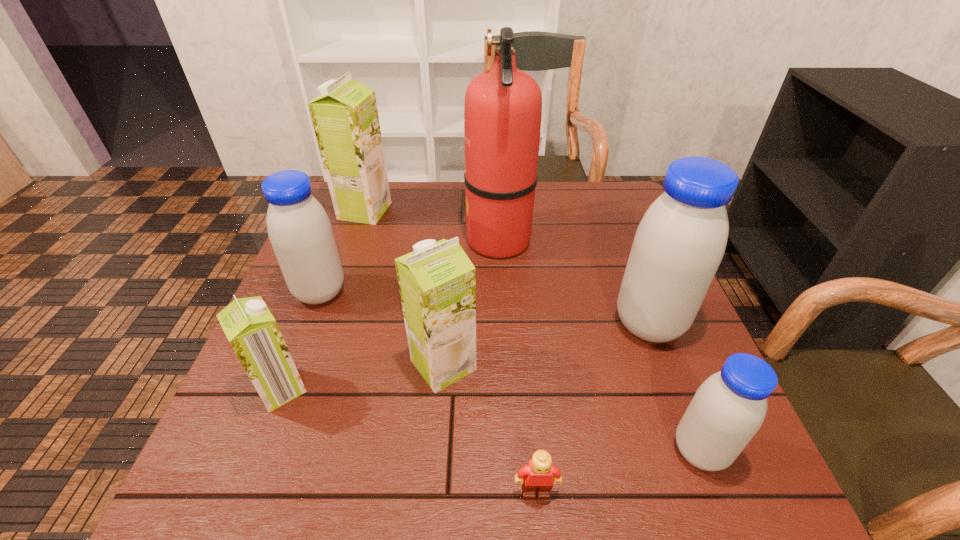
This screenshot has height=540, width=960. Find the location of `vacant space located on the back of the smallest green soya milk`. vacant space located on the back of the smallest green soya milk is located at coordinates (313, 307).

Where is `free space located on the back of the nearest blue soya milk`? The width and height of the screenshot is (960, 540). free space located on the back of the nearest blue soya milk is located at coordinates coord(656,335).

Locate an element on the screen. fire extinguisher that is at the far edge is located at coordinates (503, 105).

Identify the location of soya milk that is at the far edge. Image resolution: width=960 pixels, height=540 pixels. (345, 118).

Find the location of `soya milk present at the near edge`. soya milk present at the near edge is located at coordinates (727, 410).

This screenshot has height=540, width=960. Identify the location of Lego at the near edge. click(537, 475).

Identify the location of object that is at the far left corner. The height and width of the screenshot is (540, 960). (345, 118).

Identify the location of object present at the near right corner. The image size is (960, 540). (727, 410).

Locate an element on the screen. vacant space at the far edge is located at coordinates (393, 209).

Where is `vacant point at the near edge`? The width and height of the screenshot is (960, 540). vacant point at the near edge is located at coordinates (380, 484).